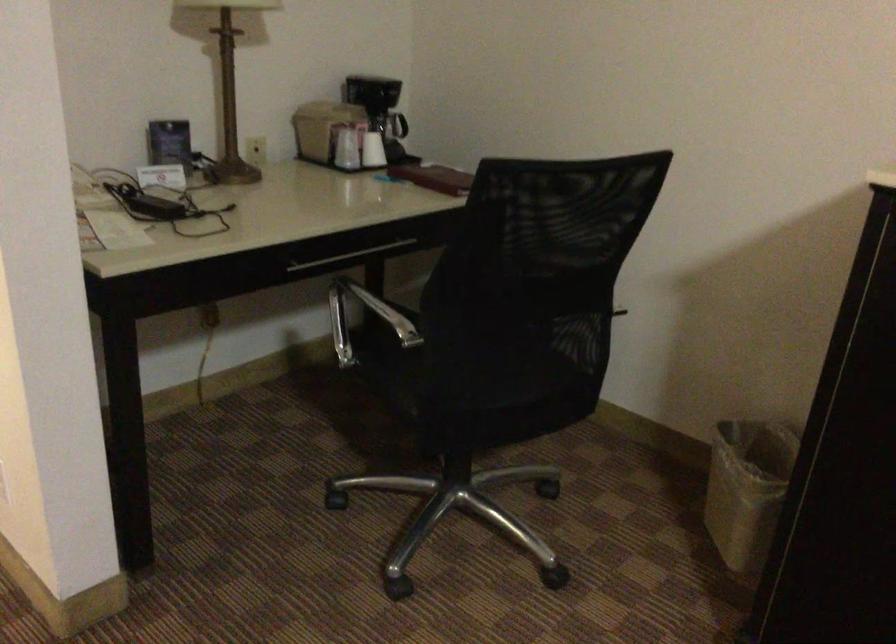
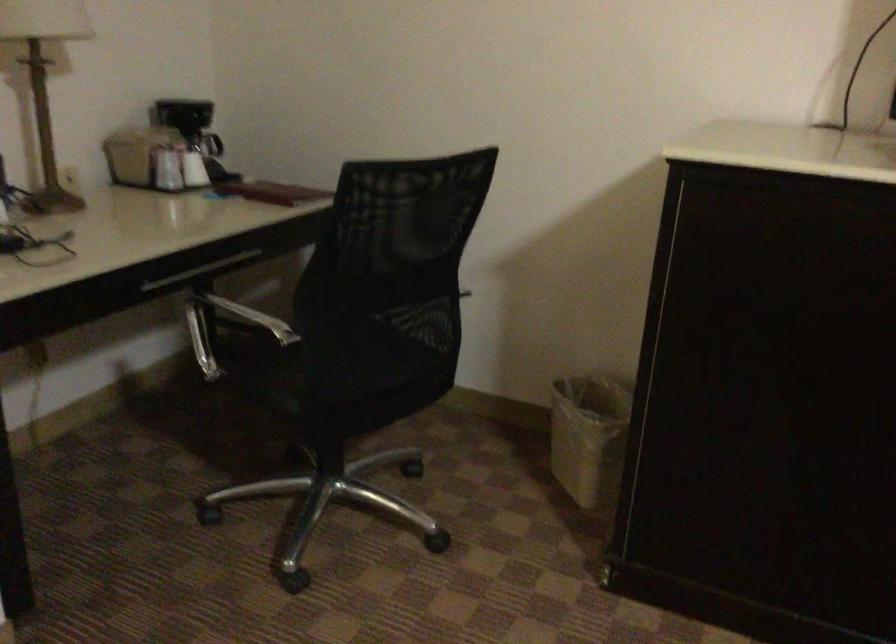
Find the pixel in the second image that matches the point at 745,491 in the first image.

(589, 437)